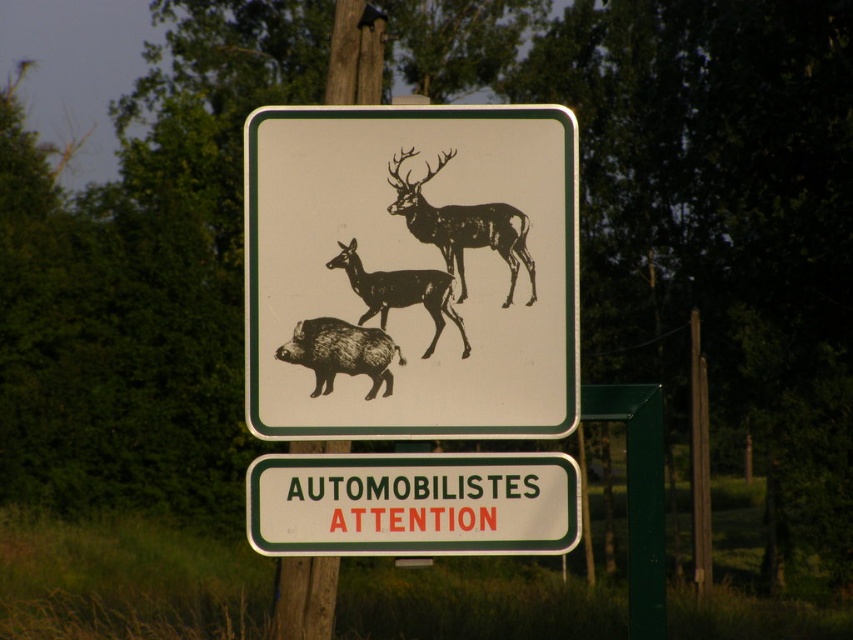
You are a hiker who needs to place a map marker exactly at the center of the black paper sign at center. According to the coordinates provided, where should you place the marker?

The black paper sign at center is located at point (x=415, y=268), so you should place the map marker exactly at those coordinates.

You are driving a car and see the green plastic signboard at center and the brown textured boar at center. Which object is closer to you?

The green plastic signboard at center is closer to you because the brown textured boar at center is behind it.